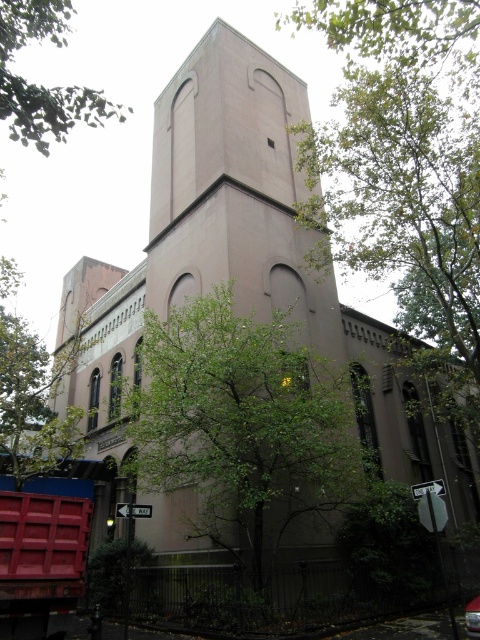
Is green leafy tree at center positioned behind green leafy tree at upper left?

Yes, it is behind green leafy tree at upper left.

Is green leafy tree at center to the right of green leafy tree at upper left from the viewer's perspective?

Indeed, green leafy tree at center is positioned on the right side of green leafy tree at upper left.

You are a GUI agent. You are given a task and a screenshot of the screen. Output one action in this format:
    pyautogui.click(x=<x>, y=<y>)
    Task: Click on the green leafy tree at center
    The image size is (480, 640).
    Given the screenshot: What is the action you would take?
    pyautogui.click(x=241, y=424)

Identify the location of green leafy tree at center. The width and height of the screenshot is (480, 640). (241, 424).